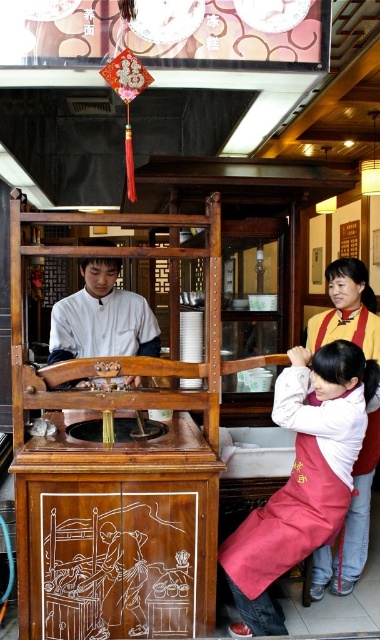
Who is more forward, (305, 476) or (99, 323)?

Point (305, 476) is in front.

Between red fabric apron at lower right and white matte shirt at center, which one is positioned higher?

Positioned higher is white matte shirt at center.

Does point (327, 540) lie behind point (61, 320)?

No, (327, 540) is in front of (61, 320).

Where is `red fabric apron at lower right`? red fabric apron at lower right is located at coordinates (302, 477).

Who is more forward, [261,524] or [316,596]?

Positioned in front is point [261,524].

This screenshot has height=640, width=380. Identify the location of red fabric apron at lower right. (302, 477).

The image size is (380, 640). Find the location of `red fabric apron at lower right`. red fabric apron at lower right is located at coordinates (302, 477).

Is red apron at lower right smaller than white matte shirt at center?

Yes, red apron at lower right is smaller than white matte shirt at center.

Can you confirm if red apron at lower right is thinner than white matte shirt at center?

Correct, red apron at lower right's width is less than white matte shirt at center's.

Between point (342, 538) and point (131, 314), which one is positioned in front?

Point (342, 538)

At what (x,y) coordinates should I click in order to perform the action: click on red apron at lower right. Please return your answer as a coordinate pair (x, y). Looking at the image, I should click on (351, 524).